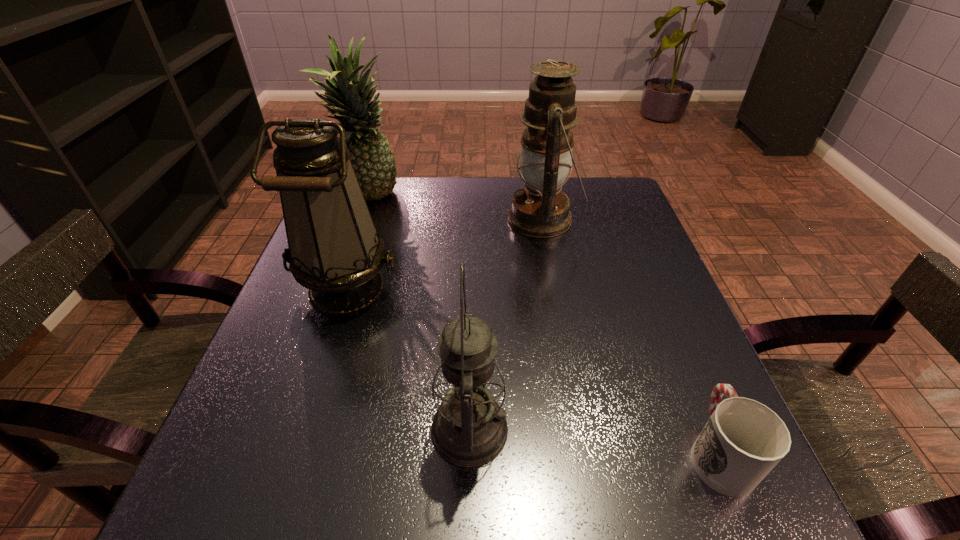
In the image, there is a desktop. Where is `vacant space at the far right corner`? Image resolution: width=960 pixels, height=540 pixels. vacant space at the far right corner is located at coordinates (570, 184).

Locate an element on the screen. This screenshot has width=960, height=540. free spot between the third object from left to right and the pineapple is located at coordinates (419, 313).

Image resolution: width=960 pixels, height=540 pixels. What are the coordinates of `free space between the rightmost oil lamp and the shortest object` in the screenshot? It's located at (x=631, y=335).

The width and height of the screenshot is (960, 540). Identify the location of free area in between the pineapple and the cup. point(543,324).

Where is `empty space between the nearest oil lamp and the shortest object`? empty space between the nearest oil lamp and the shortest object is located at coordinates (593, 441).

Where is `unoccupied position between the third object from right to left and the farthest oil lamp`? unoccupied position between the third object from right to left and the farthest oil lamp is located at coordinates (506, 325).

You are a GUI agent. You are given a task and a screenshot of the screen. Output one action in this format:
    pyautogui.click(x=<x>, y=<y>)
    Task: Click on the vacant region between the rightmost object and the farthest oil lamp
    Image resolution: width=960 pixels, height=540 pixels.
    Given the screenshot: What is the action you would take?
    pyautogui.click(x=631, y=335)

Identify the location of free spot between the pineapple and the nearest oil lamp. This screenshot has height=540, width=960. (419, 313).

What are the coordinates of `vacant point located between the third object from right to left and the leftmost oil lamp` in the screenshot? It's located at (408, 359).

Image resolution: width=960 pixels, height=540 pixels. Identify the location of vacant point located between the shortest object and the third object from right to left. (593, 441).